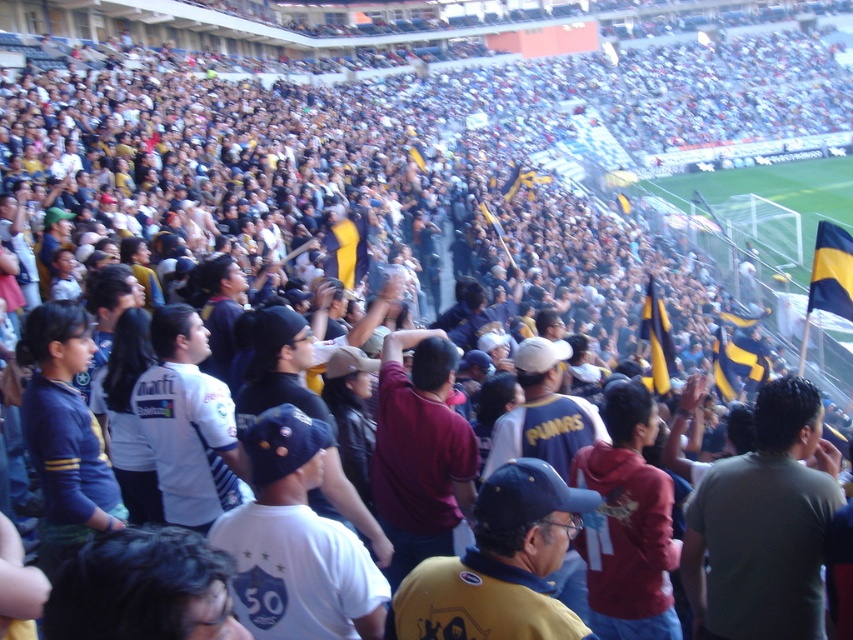
Question: Which of the following is the farthest from the observer?

Choices:
 (A) yellowmaterial/textureflag at center-right
 (B) yellow fabric flag at center

Answer: (B)

Question: Is yellowmaterial/textureflag at right positioned behind yellow fabric flag at center?

Choices:
 (A) no
 (B) yes

Answer: (A)

Question: Can you confirm if yellowmaterial/textureflag at right is positioned below yellowmaterial/textureflag at center-right?

Choices:
 (A) no
 (B) yes

Answer: (A)

Question: Among these objects, which one is farthest from the camera?

Choices:
 (A) yellowmaterial/textureflag at right
 (B) yellowmaterial/textureflag at center-right
 (C) yellow fabric flag at center

Answer: (C)

Question: Is yellowmaterial/textureflag at right to the right of yellowmaterial/textureflag at center-right from the viewer's perspective?

Choices:
 (A) yes
 (B) no

Answer: (A)

Question: Which is nearer to the yellow fabric flag at center?

Choices:
 (A) yellowmaterial/textureflag at right
 (B) yellowmaterial/textureflag at center-right

Answer: (B)